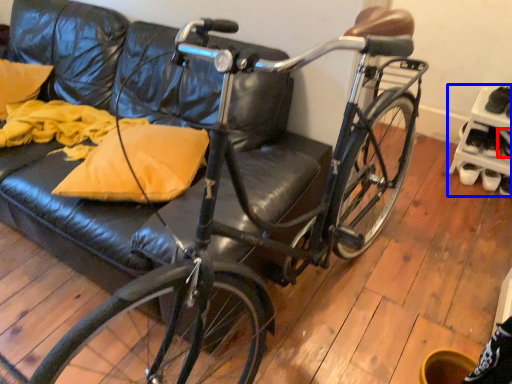
Question: Which point is further to the camera, shoe (highlighted by a red box) or shelf (highlighted by a blue box)?

Choices:
 (A) shoe
 (B) shelf

Answer: (A)